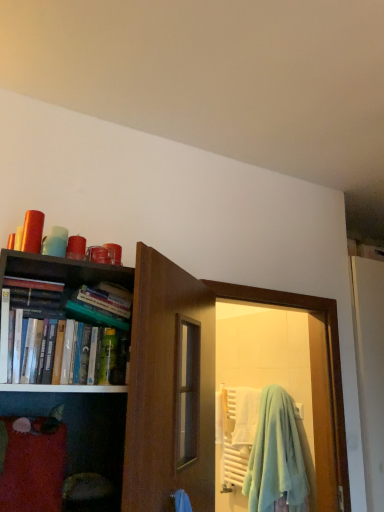
Question: Would you say hardcover books at left is part of light blue fleece beach towel at door's contents?

Choices:
 (A) no
 (B) yes

Answer: (A)

Question: Considering the relative sizes of light blue fleece beach towel at door and hardcover books at left in the image provided, is light blue fleece beach towel at door taller than hardcover books at left?

Choices:
 (A) yes
 (B) no

Answer: (A)

Question: Is light blue fleece beach towel at door further to camera compared to hardcover books at left?

Choices:
 (A) no
 (B) yes

Answer: (B)

Question: Considering the relative positions of light blue fleece beach towel at door and hardcover books at left in the image provided, is light blue fleece beach towel at door to the left of hardcover books at left from the viewer's perspective?

Choices:
 (A) no
 (B) yes

Answer: (A)

Question: Considering the relative sizes of light blue fleece beach towel at door and hardcover books at left in the image provided, is light blue fleece beach towel at door bigger than hardcover books at left?

Choices:
 (A) no
 (B) yes

Answer: (B)

Question: Does point (109, 300) appear closer or farther from the camera than point (221, 455)?

Choices:
 (A) closer
 (B) farther

Answer: (A)

Question: Would you say hardcover books at left is inside or outside light blue fleece beach towel at door?

Choices:
 (A) inside
 (B) outside

Answer: (B)

Question: In terms of size, does hardcover books at left appear bigger or smaller than light blue fleece beach towel at door?

Choices:
 (A) small
 (B) big

Answer: (A)

Question: From the image's perspective, is hardcover books at left positioned above or below light blue fleece beach towel at door?

Choices:
 (A) below
 (B) above

Answer: (B)

Question: Is light blue fleece beach towel at door wider or thinner than hardcover books at left?

Choices:
 (A) thin
 (B) wide

Answer: (B)

Question: In the image, is light blue fleece beach towel at door on the left side or the right side of hardcover books at left?

Choices:
 (A) right
 (B) left

Answer: (A)

Question: Choose the correct answer: Is light blue fleece beach towel at door inside hardcover books at left or outside it?

Choices:
 (A) inside
 (B) outside

Answer: (B)

Question: From their relative heights in the image, would you say light blue fleece beach towel at door is taller or shorter than hardcover books at left?

Choices:
 (A) short
 (B) tall

Answer: (B)

Question: Does point (120, 322) appear closer or farther from the camera than point (112, 332)?

Choices:
 (A) closer
 (B) farther

Answer: (B)

Question: In the image, is hardcover books at left positioned in front of or behind green plastic bottle at center?

Choices:
 (A) behind
 (B) front

Answer: (B)